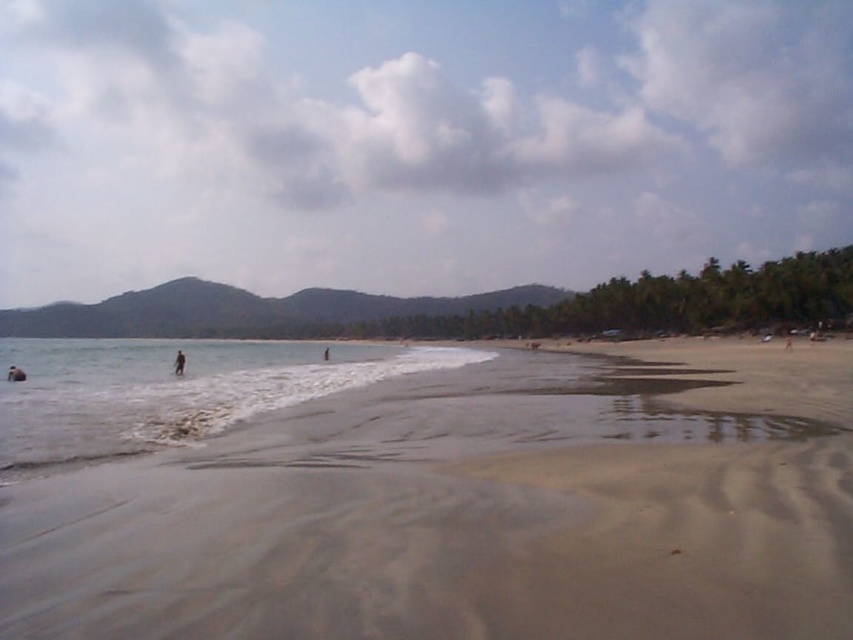
Question: Which point is farther to the camera?

Choices:
 (A) pos(180,349)
 (B) pos(323,352)

Answer: (B)

Question: Can you confirm if sandy beach at lower center is positioned below skinny person at center?

Choices:
 (A) no
 (B) yes

Answer: (A)

Question: Based on their relative distances, which object is nearer to the smooth skin person at lower left?

Choices:
 (A) skinny person at center
 (B) clear water at lower left

Answer: (A)

Question: Is smooth skin person at lower left wider than skinny person at center?

Choices:
 (A) no
 (B) yes

Answer: (A)

Question: Among these objects, which one is nearest to the camera?

Choices:
 (A) dark brown skin at lower left
 (B) sandy beach at lower center
 (C) skinny person at lower right
 (D) skinny person at center

Answer: (B)

Question: Can you confirm if sandy beach at lower center is positioned to the right of smooth skin person at lower left?

Choices:
 (A) yes
 (B) no

Answer: (A)